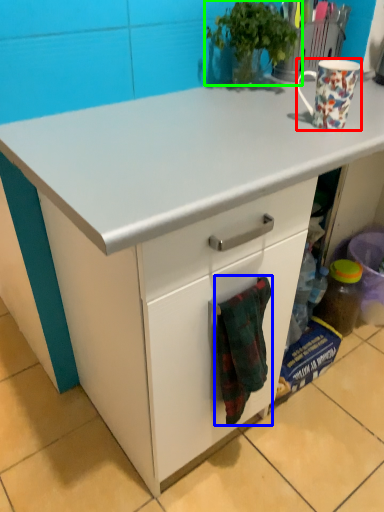
Question: Which object is the farthest from coffee cup (highlighted by a red box)? Choose among these: blanket (highlighted by a blue box) or houseplant (highlighted by a green box).

Choices:
 (A) blanket
 (B) houseplant

Answer: (A)